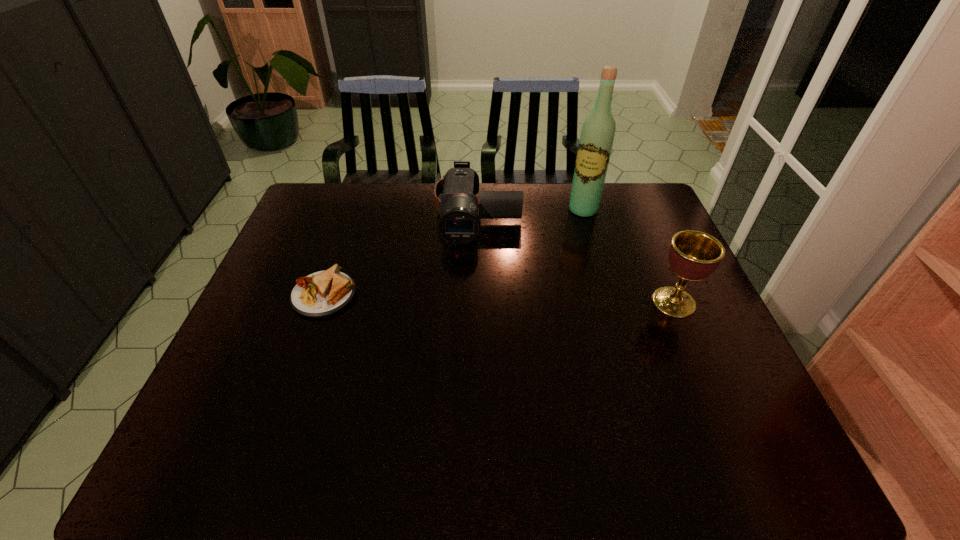
Where is `the leftmost object`? the leftmost object is located at coordinates (323, 293).

Find the location of a particular element. The image size is (960, 540). the shortest object is located at coordinates point(323,293).

Identify the location of the rightmost object. (693, 255).

At what (x,y) coordinates should I click in order to perform the action: click on the second tallest object. Please return your answer as a coordinate pair (x, y). This screenshot has height=540, width=960. Looking at the image, I should click on coord(693,255).

Identify the location of the second object from left to right. pos(459,223).

Image resolution: width=960 pixels, height=540 pixels. I want to click on the second shortest object, so (x=459, y=223).

What are the coordinates of `the third object from left to right` in the screenshot? It's located at (597, 135).

In order to click on wine bottle in this screenshot , I will do `click(597, 135)`.

Where is `vacant area situated 0.330m on the right of the leftmost object`? The width and height of the screenshot is (960, 540). vacant area situated 0.330m on the right of the leftmost object is located at coordinates (477, 295).

Find the location of a particular element. Image resolution: width=960 pixels, height=540 pixels. free point located on the left of the rightmost object is located at coordinates (565, 302).